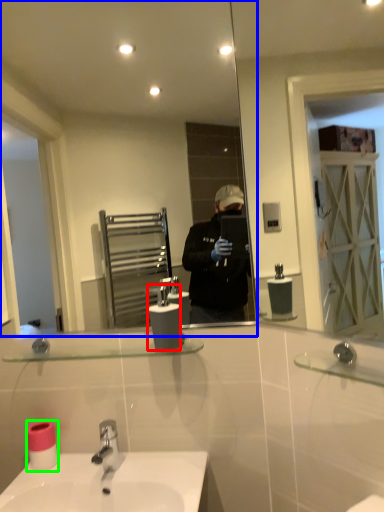
Question: Which is farther away from soap dispenser (highlighted by a red box)? mirror (highlighted by a blue box) or toilet paper (highlighted by a green box)?

Choices:
 (A) mirror
 (B) toilet paper

Answer: (A)